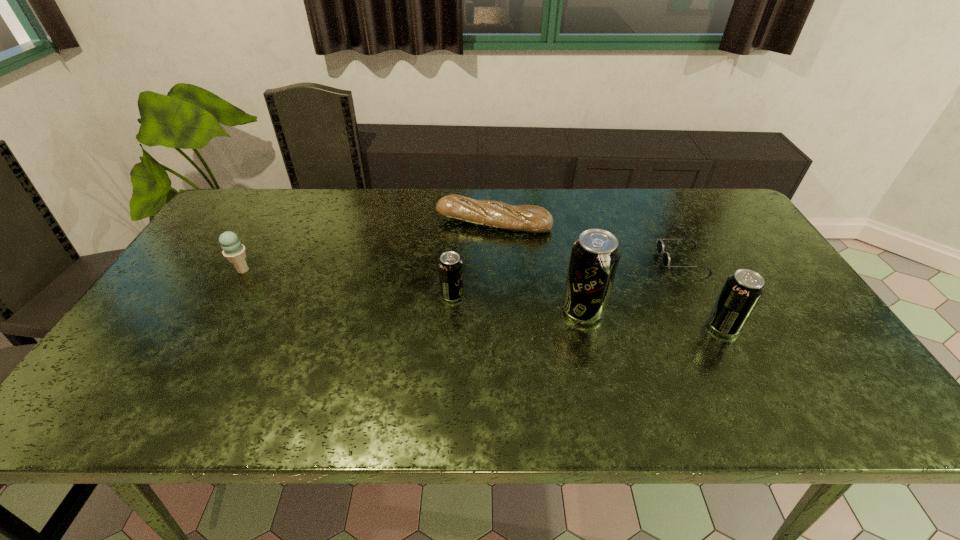
Find the location of a particular element. vacant position located 0.190m on the right of the tallest object is located at coordinates (679, 310).

What are the coordinates of `free space located 0.300m on the back of the second tallest soda can` in the screenshot? It's located at (678, 241).

You are a GUI agent. You are given a task and a screenshot of the screen. Output one action in this format:
    pyautogui.click(x=<x>, y=<y>)
    Task: Click on the vacant space located on the right of the second shortest object
    The image size is (960, 540).
    Given the screenshot: What is the action you would take?
    pyautogui.click(x=636, y=223)

Locate an element on the screen. The image size is (960, 540). vacant region located 0.230m on the front-facing side of the sunglasses is located at coordinates (580, 259).

The image size is (960, 540). What are the coordinates of `free location located on the front-facing side of the sunglasses` in the screenshot? It's located at (535, 259).

What are the coordinates of `free region located 0.190m on the front-facing side of the sunglasses` in the screenshot? It's located at (x=594, y=259).

The height and width of the screenshot is (540, 960). What are the coordinates of `blank space located on the back of the leftmost object` in the screenshot? It's located at pos(279,208).

In order to click on object that is at the far edge in this screenshot , I will do `click(530, 218)`.

The height and width of the screenshot is (540, 960). What are the coordinates of `object that is positioned at the left edge` in the screenshot? It's located at (233, 250).

The height and width of the screenshot is (540, 960). I want to click on free space at the far edge, so click(428, 205).